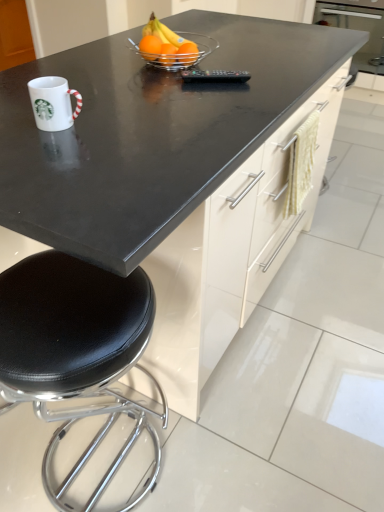
Where is `free space in front of black plastic remote at center`? free space in front of black plastic remote at center is located at coordinates (223, 95).